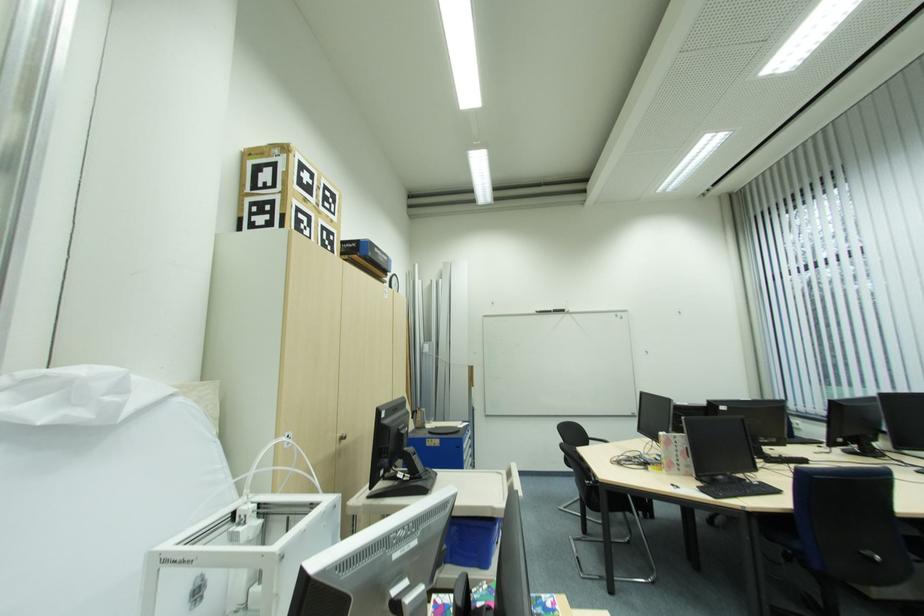
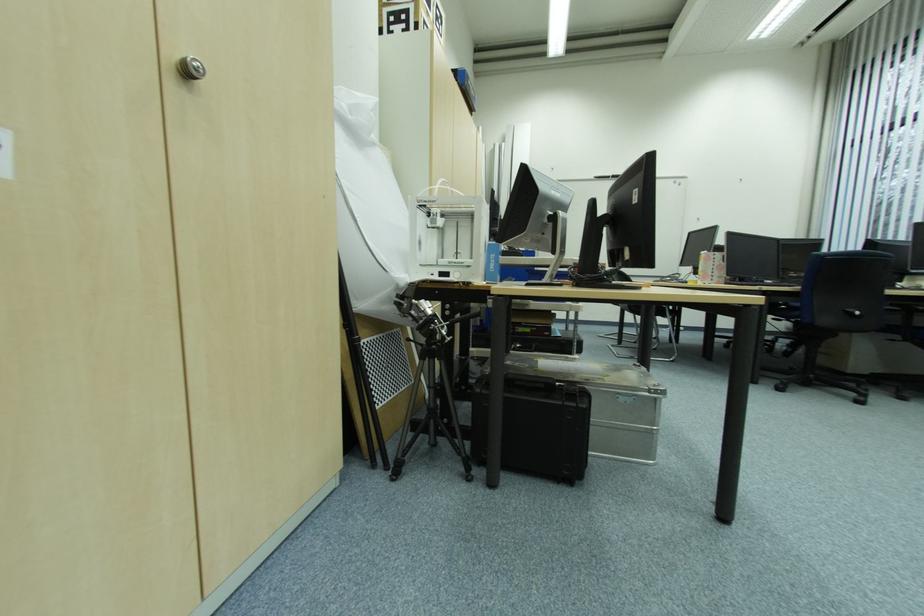
Which direction would the cameraman need to move to produce the second image?

The cameraman moved toward left, backward.